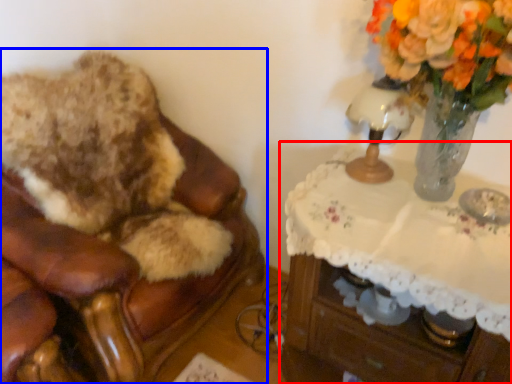
Question: Which object appears farthest to the camera in this image, table (highlighted by a red box) or furniture (highlighted by a blue box)?

Choices:
 (A) table
 (B) furniture

Answer: (B)